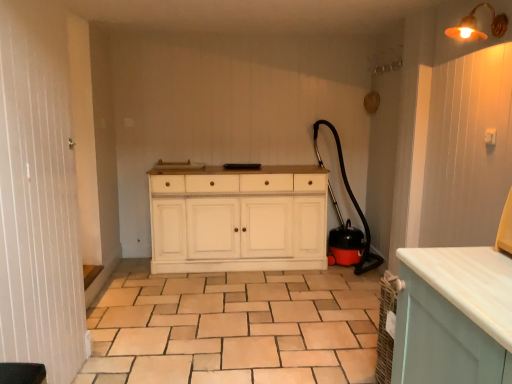
Question: Does beige ceramic tile at center have a greater height compared to black rubber garden hose at right?

Choices:
 (A) yes
 (B) no

Answer: (B)

Question: From the image's perspective, is beige ceramic tile at center under black rubber garden hose at right?

Choices:
 (A) yes
 (B) no

Answer: (A)

Question: Considering the relative positions of beige ceramic tile at center and black rubber garden hose at right in the image provided, is beige ceramic tile at center to the right of black rubber garden hose at right from the viewer's perspective?

Choices:
 (A) yes
 (B) no

Answer: (B)

Question: Does beige ceramic tile at center have a greater width compared to black rubber garden hose at right?

Choices:
 (A) yes
 (B) no

Answer: (A)

Question: From a real-world perspective, is beige ceramic tile at center beneath black rubber garden hose at right?

Choices:
 (A) no
 (B) yes

Answer: (B)

Question: Can you confirm if beige ceramic tile at center is thinner than black rubber garden hose at right?

Choices:
 (A) no
 (B) yes

Answer: (A)

Question: Are white wood screen door at left and metallic brass light fixture at upper right far apart?

Choices:
 (A) no
 (B) yes

Answer: (B)

Question: Is white wood screen door at left outside metallic brass light fixture at upper right?

Choices:
 (A) no
 (B) yes

Answer: (B)

Question: Is white wood screen door at left positioned in front of metallic brass light fixture at upper right?

Choices:
 (A) yes
 (B) no

Answer: (A)

Question: Considering the relative sizes of white wood screen door at left and metallic brass light fixture at upper right in the image provided, is white wood screen door at left smaller than metallic brass light fixture at upper right?

Choices:
 (A) no
 (B) yes

Answer: (A)

Question: Is white wood screen door at left thinner than metallic brass light fixture at upper right?

Choices:
 (A) no
 (B) yes

Answer: (B)

Question: From the image's perspective, would you say white wood screen door at left is positioned over metallic brass light fixture at upper right?

Choices:
 (A) yes
 (B) no

Answer: (B)

Question: Is black rubber garden hose at right oriented away from beige ceramic tile at center?

Choices:
 (A) yes
 (B) no

Answer: (B)